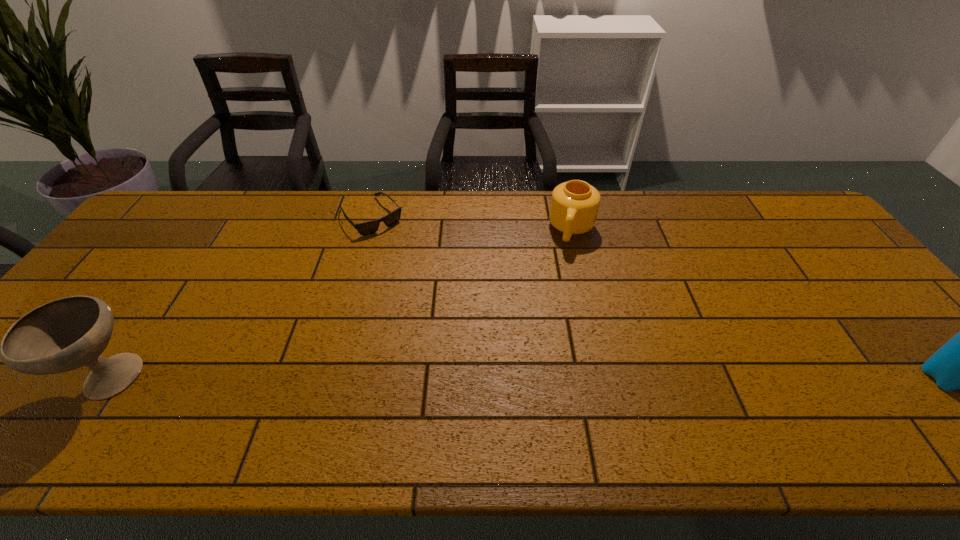
The width and height of the screenshot is (960, 540). In the image, there is a desktop. Identify the location of vacant space at the left edge. (170, 239).

Locate an element on the screen. free space at the right edge of the desktop is located at coordinates (826, 262).

Locate an element on the screen. The image size is (960, 540). vacant area between the third tallest object and the shortest object is located at coordinates pyautogui.click(x=471, y=223).

This screenshot has height=540, width=960. I want to click on free space between the leftmost object and the third object from right to left, so click(x=240, y=299).

You are a GUI agent. You are given a task and a screenshot of the screen. Output one action in this format:
    pyautogui.click(x=<x>, y=<y>)
    Task: Click on the empty space between the third object from left to right and the third object from right to left
    
    Given the screenshot: What is the action you would take?
    pyautogui.click(x=471, y=223)

This screenshot has height=540, width=960. What are the coordinates of `free space between the second object from right to left and the chalice` in the screenshot? It's located at (341, 305).

Image resolution: width=960 pixels, height=540 pixels. I want to click on vacant space that's between the second tallest object and the shortest object, so click(x=240, y=299).

Locate an element on the screen. This screenshot has height=540, width=960. vacant space that's between the second object from left to right and the leftmost object is located at coordinates (240, 299).

Locate an element on the screen. This screenshot has height=540, width=960. vacant space that is in between the chalice and the third tallest object is located at coordinates (341, 305).

Find the location of a particular element. This screenshot has width=960, height=540. empty location between the leftmost object and the third object from left to right is located at coordinates (341, 305).